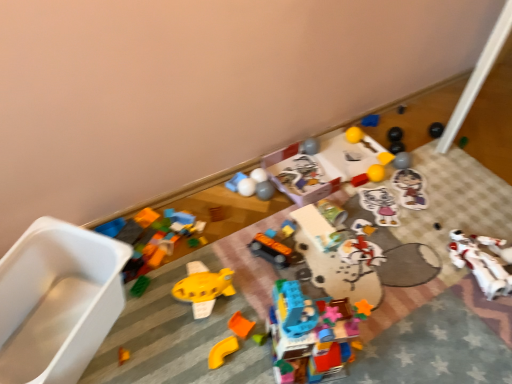
This screenshot has width=512, height=384. I want to click on vacant space behind matte gray ball at center, which is the 7th toy in left-to-right order, so click(276, 168).